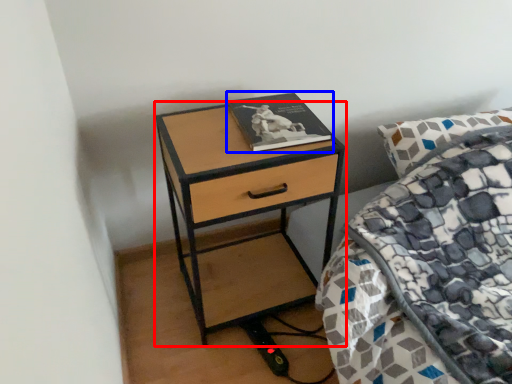
Question: Which object is further to the camera taking this photo, nightstand (highlighted by a red box) or book (highlighted by a blue box)?

Choices:
 (A) nightstand
 (B) book

Answer: (B)